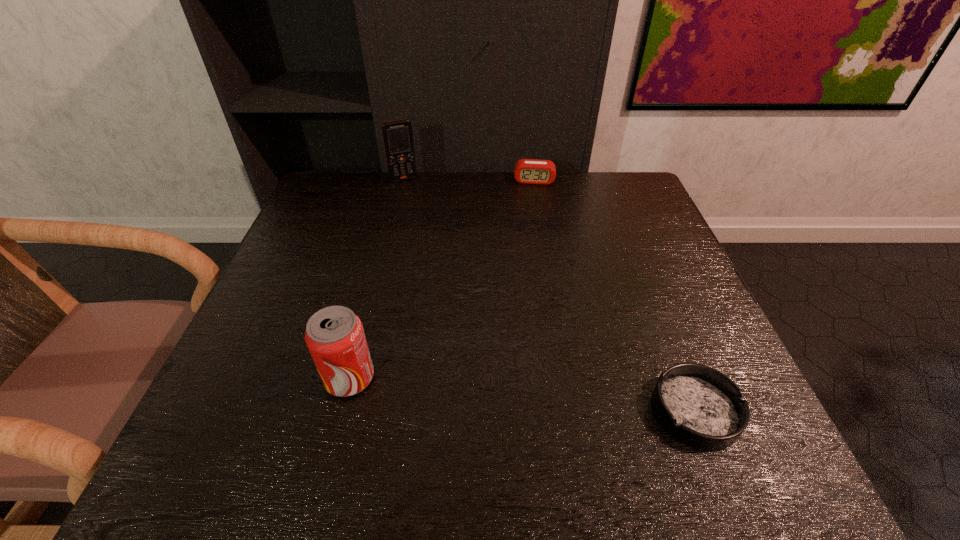
Find the location of a particular element. free space on the desktop that is between the soda can and the shortest object and is positioned on the front-facing side of the third tallest object is located at coordinates (531, 395).

Find the location of a particular element. The image size is (960, 540). free spot on the desktop that is between the soda can and the ashtray and is positioned on the screen of the cellular telephone is located at coordinates (511, 393).